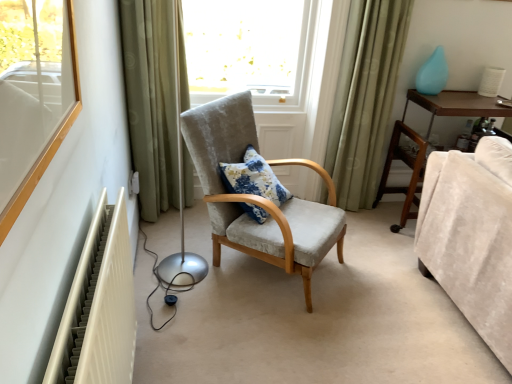
You are a GUI agent. You are given a task and a screenshot of the screen. Output one action in this format:
    pyautogui.click(x=<x>, y=<y>)
    Task: Click on the vacant area to the right of teal glossy vase at upper right
    
    Given the screenshot: What is the action you would take?
    pyautogui.click(x=462, y=95)